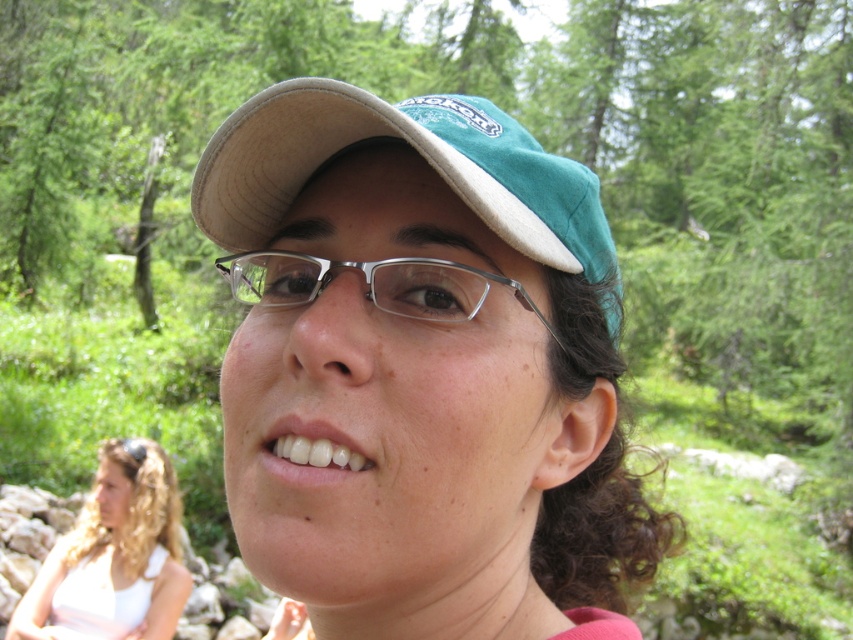
Does green fabric baseball cap at center appear on the right side of clear plastic glasses at center?

Correct, you'll find green fabric baseball cap at center to the right of clear plastic glasses at center.

Between green fabric baseball cap at center and clear plastic glasses at center, which one has more height?

green fabric baseball cap at center

Is point (239, 252) positioned before point (410, 275)?

No, it is behind (410, 275).

Locate an element on the screen. Image resolution: width=853 pixels, height=640 pixels. green fabric baseball cap at center is located at coordinates (421, 156).

Is point (474, 497) positioned before point (231, 234)?

Yes.

Is green suede cap at center below green fabric baseball cap at center?

Yes.

Is point (210, 186) positioned behind point (405, 113)?

No.

At what (x,y) coordinates should I click in order to perform the action: click on green suede cap at center. Please return your answer as a coordinate pair (x, y). The image size is (853, 640). Looking at the image, I should click on (422, 371).

Looking at this image, who is shorter, green fabric baseball cap at center or blonde hair at lower left?

With less height is green fabric baseball cap at center.

Does green fabric baseball cap at center have a lesser width compared to blonde hair at lower left?

Correct, green fabric baseball cap at center's width is less than blonde hair at lower left's.

Is point (236, 129) closer to camera compared to point (20, 611)?

Yes, point (236, 129) is in front of point (20, 611).

Where is `green fabric baseball cap at center`? green fabric baseball cap at center is located at coordinates (421, 156).